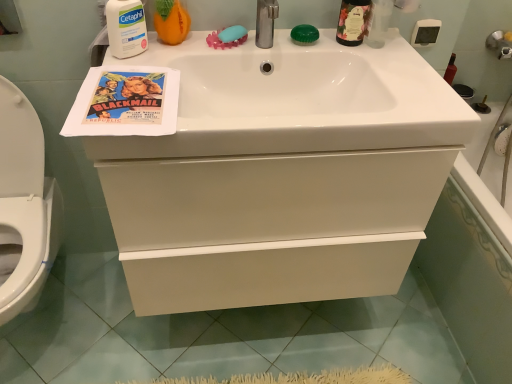
In order to click on space that is in front of green glass bottle at upper right in this screenshot , I will do `click(379, 62)`.